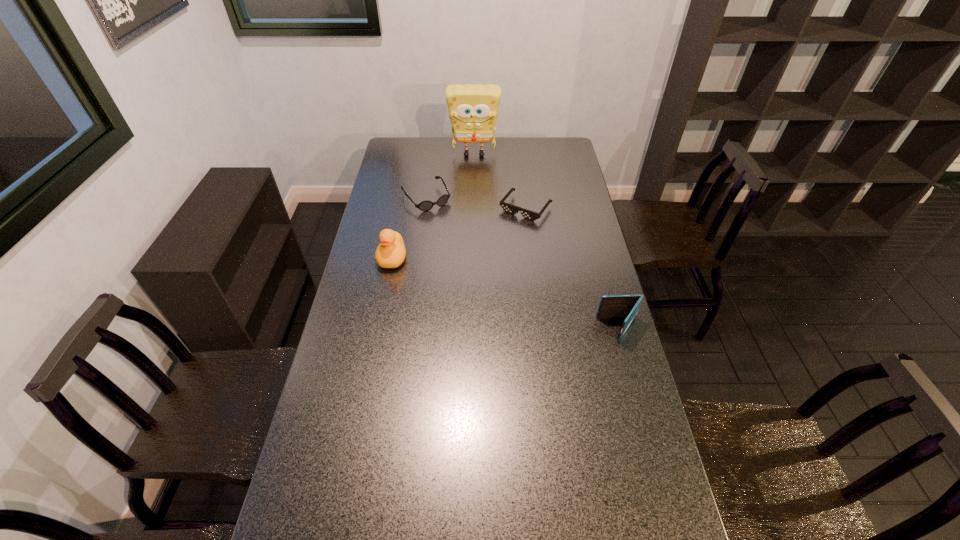
I want to click on free space between the fourth tallest object and the third shortest object, so [522, 264].

Find the location of a particular element. The height and width of the screenshot is (540, 960). unoccupied position between the duck and the nearest object is located at coordinates (506, 294).

Where is `object that stands as the second closest to the duck`? Image resolution: width=960 pixels, height=540 pixels. object that stands as the second closest to the duck is located at coordinates (509, 208).

Identify which object is the nearest to the left sunglasses. Please provide its 2D coordinates. Your answer should be formatted as a tuple, i.e. [(x, y)], where the tuple contains the x and y coordinates of a point satisfying the conditions above.

[(473, 109)]

The image size is (960, 540). Identify the location of vacant space that satisfies the following two spatial constraints: 1. on the front side of the right sunglasses; 2. on the exterior surface of the wallet. (540, 329).

Find the location of `free spot that satisfies the following two spatial constraints: 1. on the front side of the wallet; 2. on the exterior surface of the right sunglasses`. free spot that satisfies the following two spatial constraints: 1. on the front side of the wallet; 2. on the exterior surface of the right sunglasses is located at coordinates (540, 329).

The image size is (960, 540). What are the coordinates of `free point that satisfies the following two spatial constraints: 1. on the front side of the left sunglasses; 2. on the exterior surface of the rightmost object` in the screenshot? It's located at (407, 329).